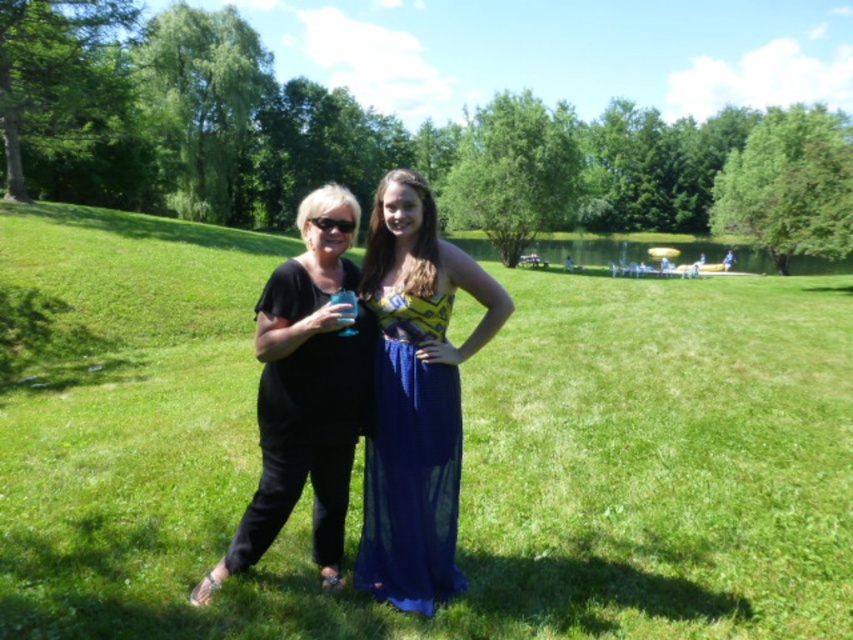
Question: Is black matte dress at center closer to the viewer compared to blue chiffon dress at center?

Choices:
 (A) yes
 (B) no

Answer: (A)

Question: Based on their relative distances, which object is nearer to the blue chiffon dress at center?

Choices:
 (A) green grassy field at center
 (B) black matte dress at center

Answer: (B)

Question: Estimate the real-world distances between objects in this image. Which object is farther from the green grassy field at center?

Choices:
 (A) green grassy lake at center
 (B) black matte dress at center
 (C) blue chiffon dress at center

Answer: (A)

Question: Does green grassy field at center appear under green grassy lake at center?

Choices:
 (A) no
 (B) yes

Answer: (B)

Question: Which is nearer to the blue chiffon dress at center?

Choices:
 (A) green grassy field at center
 (B) green grassy lake at center
 (C) black matte dress at center

Answer: (C)

Question: Does green grassy field at center have a larger size compared to blue chiffon dress at center?

Choices:
 (A) yes
 (B) no

Answer: (A)